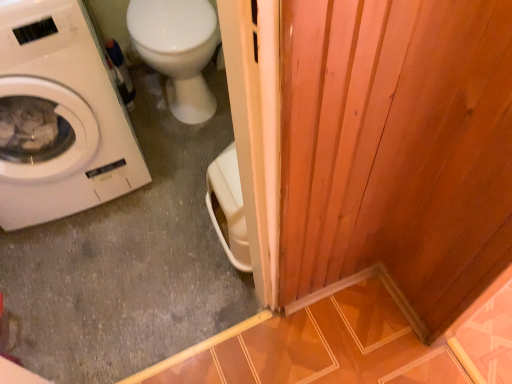
Question: In the image, is white matte washing machine at left on the left side or the right side of white glossy toilet at upper left?

Choices:
 (A) right
 (B) left

Answer: (B)

Question: Based on their sizes in the image, would you say white matte washing machine at left is bigger or smaller than white glossy toilet at upper left?

Choices:
 (A) small
 (B) big

Answer: (B)

Question: Is white matte washing machine at left in front of or behind white glossy toilet at upper left in the image?

Choices:
 (A) front
 (B) behind

Answer: (A)

Question: In the image, is white glossy toilet at upper left on the left side or the right side of white matte washing machine at left?

Choices:
 (A) right
 (B) left

Answer: (A)

Question: Do you think white glossy toilet at upper left is within white matte washing machine at left, or outside of it?

Choices:
 (A) outside
 (B) inside

Answer: (A)

Question: From a real-world perspective, relative to white matte washing machine at left, is white glossy toilet at upper left vertically above or below?

Choices:
 (A) below
 (B) above

Answer: (A)

Question: Considering the positions of point (174, 13) and point (33, 153), is point (174, 13) closer or farther from the camera than point (33, 153)?

Choices:
 (A) farther
 (B) closer

Answer: (A)